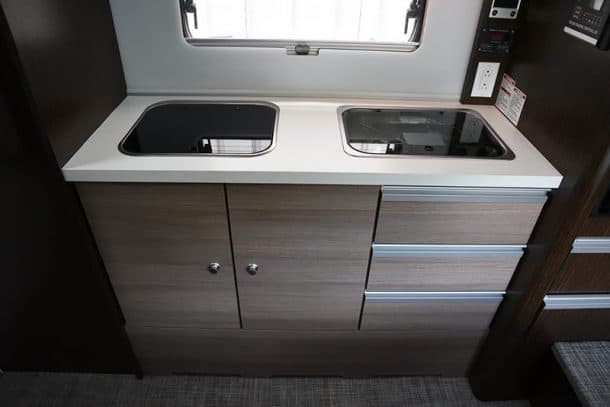
At what (x,y) coordinates should I click in order to perform the action: click on switch board. Please return your answer as a coordinate pair (x, y). Looking at the image, I should click on (487, 75).